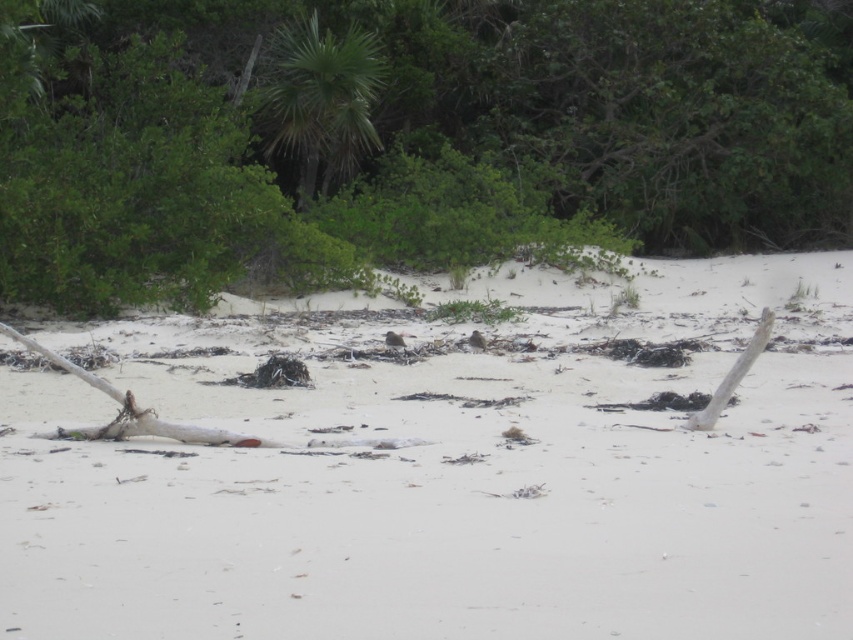
Question: Which point is farther from the camera taking this photo?

Choices:
 (A) (125, 56)
 (B) (515, 413)

Answer: (A)

Question: Which point is farther from the camera taking this photo?

Choices:
 (A) (672, 465)
 (B) (343, 115)
 (C) (78, 56)

Answer: (B)

Question: Does green leafy tree at upper center have a lesser width compared to green leafy palm tree at upper center?

Choices:
 (A) no
 (B) yes

Answer: (A)

Question: Does white sandy beach at center appear on the right side of green leafy tree at upper center?

Choices:
 (A) yes
 (B) no

Answer: (B)

Question: Estimate the real-world distances between objects in this image. Which object is closer to the green leafy tree at upper center?

Choices:
 (A) white sandy beach at center
 (B) green leafy palm tree at upper center

Answer: (B)

Question: In this image, where is green leafy tree at upper center located relative to green leafy palm tree at upper center?

Choices:
 (A) left
 (B) right

Answer: (B)